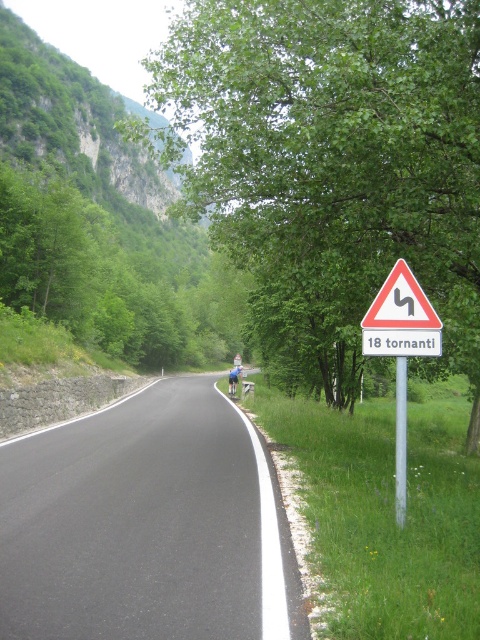
Question: Observing the image, what is the correct spatial positioning of black asphalt road at center in reference to white triangular sign with black curved arrow at right?

Choices:
 (A) above
 (B) below

Answer: (B)

Question: Which object is closer to the camera taking this photo?

Choices:
 (A) blue fabric motorcyclist at center
 (B) white plastic triangle at center-right

Answer: (B)

Question: Can you confirm if white triangular sign with black curved arrow at right is bigger than white plastic triangle at center-right?

Choices:
 (A) no
 (B) yes

Answer: (B)

Question: Which object is the closest to the blue fabric motorcyclist at center?

Choices:
 (A) white plastic triangle at center-right
 (B) black asphalt road at center

Answer: (B)

Question: Does white triangular sign with black curved arrow at right come in front of white plastic triangle at center-right?

Choices:
 (A) yes
 (B) no

Answer: (A)

Question: Estimate the real-world distances between objects in this image. Which object is closer to the white triangular sign with black curved arrow at right?

Choices:
 (A) blue fabric motorcyclist at center
 (B) black asphalt road at center
 (C) white plastic triangle at center-right

Answer: (C)